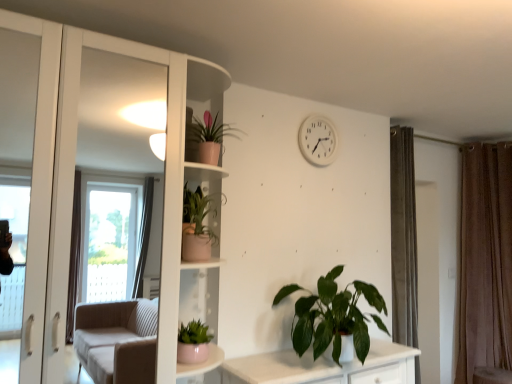
Where is `white plastic clock at upper center`? The height and width of the screenshot is (384, 512). white plastic clock at upper center is located at coordinates (318, 140).

This screenshot has width=512, height=384. What do you see at coordinates (197, 225) in the screenshot?
I see `matte pink pot at center-left, which is the second houseplant in left-to-right order` at bounding box center [197, 225].

Measure the distance between point (208, 238) and camera.

A distance of 2.01 meters exists between point (208, 238) and camera.

Image resolution: width=512 pixels, height=384 pixels. I want to click on matte pink pot at lower center, the 3th houseplant from the top, so click(x=193, y=343).

The width and height of the screenshot is (512, 384). I want to click on brown velvet curtain at right, so click(485, 260).

Which object is further away from the camera, pink matte pot at upper center, the second houseplant viewed from the right, or brown velvet curtain at right?

brown velvet curtain at right.

From the image's perspective, between pink matte pot at upper center, which appears as the third houseplant when viewed from the left, and brown velvet curtain at right, who is located below?

brown velvet curtain at right.

Are pink matte pot at upper center, which appears as the third houseplant when viewed from the left, and brown velvet curtain at right beside each other?

No, pink matte pot at upper center, which appears as the third houseplant when viewed from the left, is not making contact with brown velvet curtain at right.

Could you tell me if pink matte pot at upper center, the second houseplant viewed from the right, is facing brown velvet curtain at right?

No, pink matte pot at upper center, the second houseplant viewed from the right, is not aimed at brown velvet curtain at right.

What's the angular difference between brown velvet curtain at right and matte pink pot at center-left, which is the second houseplant in left-to-right order,'s facing directions?

The angle between the facing direction of brown velvet curtain at right and the facing direction of matte pink pot at center-left, which is the second houseplant in left-to-right order, is 110 degrees.

From the image's perspective, is brown velvet curtain at right on matte pink pot at center-left, the 3th houseplant in the right-to-left sequence?

No, from the image's perspective, brown velvet curtain at right is not over matte pink pot at center-left, the 3th houseplant in the right-to-left sequence.

Is brown velvet curtain at right facing away from matte pink pot at center-left, the third houseplant positioned from the bottom?

That's not correct — brown velvet curtain at right is not looking away from matte pink pot at center-left, the third houseplant positioned from the bottom.

Which point is more distant from viewer, (481, 259) or (188, 216)?

The point (481, 259) is behind.

Is white plastic clock at upper center beside brown velvet curtain at right?

No, white plastic clock at upper center is not making contact with brown velvet curtain at right.

Would you say white plastic clock at upper center contains brown velvet curtain at right?

Definitely not — brown velvet curtain at right is not inside white plastic clock at upper center.

Considering the points (313, 159) and (476, 153), which point is in front, point (313, 159) or point (476, 153)?

The point (313, 159) is closer to the camera.

Which is more to the left, brown velvet curtain at right or green matte plant at lower center, acting as the 4th houseplant starting from the top?

green matte plant at lower center, acting as the 4th houseplant starting from the top.

From the image's perspective, is brown velvet curtain at right located above green matte plant at lower center, which ranks as the 1th houseplant in right-to-left order?

Indeed, from the image's perspective, brown velvet curtain at right is shown above green matte plant at lower center, which ranks as the 1th houseplant in right-to-left order.

Considering the points (505, 293) and (364, 331), which point is in front, point (505, 293) or point (364, 331)?

Positioned in front is point (364, 331).

Could you measure the distance between white plastic clock at upper center and matte pink pot at lower center, the 3th houseplant from the top?

white plastic clock at upper center and matte pink pot at lower center, the 3th houseplant from the top, are 4.68 feet apart.

The height and width of the screenshot is (384, 512). Identify the location of clock above the matte pink pot at lower center, acting as the second houseplant starting from the bottom (from the image's perspective). (318, 140).

Is white plastic clock at upper center in front of matte pink pot at lower center, which is counted as the 1th houseplant, starting from the left?

No, the depth of white plastic clock at upper center is greater than that of matte pink pot at lower center, which is counted as the 1th houseplant, starting from the left.

Looking at this image, considering the relative sizes of white plastic clock at upper center and matte pink pot at lower center, which is counted as the 1th houseplant, starting from the left, in the image provided, is white plastic clock at upper center smaller than matte pink pot at lower center, which is counted as the 1th houseplant, starting from the left,?

Incorrect, white plastic clock at upper center is not smaller in size than matte pink pot at lower center, which is counted as the 1th houseplant, starting from the left.

Considering the positions of objects brown velvet curtain at right and matte pink pot at lower center, which is counted as the 1th houseplant, starting from the left, in the image provided, who is more to the right, brown velvet curtain at right or matte pink pot at lower center, which is counted as the 1th houseplant, starting from the left,?

brown velvet curtain at right.

Is brown velvet curtain at right oriented away from matte pink pot at lower center, placed as the 4th houseplant when sorted from right to left?

No, brown velvet curtain at right's orientation is not away from matte pink pot at lower center, placed as the 4th houseplant when sorted from right to left.

Does point (497, 364) come behind point (190, 334)?

Yes, point (497, 364) is farther from viewer.

From the image's perspective, which is above, pink matte pot at upper center, the second houseplant viewed from the right, or matte pink pot at lower center, the 3th houseplant from the top?

pink matte pot at upper center, the second houseplant viewed from the right, is shown above in the image.

Which of these two, pink matte pot at upper center, which appears as the third houseplant when viewed from the left, or matte pink pot at lower center, acting as the second houseplant starting from the bottom, is wider?

With larger width is matte pink pot at lower center, acting as the second houseplant starting from the bottom.

Is pink matte pot at upper center, the second houseplant viewed from the right, next to matte pink pot at lower center, placed as the 4th houseplant when sorted from right to left, and touching it?

pink matte pot at upper center, the second houseplant viewed from the right, is not next to matte pink pot at lower center, placed as the 4th houseplant when sorted from right to left, and they're not touching.

At what (x,y) coordinates should I click in order to perform the action: click on houseplant that is the 2nd object to the left of the pink matte pot at upper center, which appears as the third houseplant when viewed from the left, starting at the anchor. Please return your answer as a coordinate pair (x, y). The height and width of the screenshot is (384, 512). Looking at the image, I should click on (193, 343).

Where is `curtain behind the pink matte pot at upper center, the second houseplant viewed from the right`? This screenshot has height=384, width=512. curtain behind the pink matte pot at upper center, the second houseplant viewed from the right is located at coordinates (485, 260).

Starting from the brown velvet curtain at right, which houseplant is the 2nd one in front? Please provide its 2D coordinates.

[(197, 225)]

Estimate the real-world distances between objects in this image. Which object is further from green matte plant at lower center, acting as the 4th houseplant starting from the top, brown velvet curtain at right or matte pink pot at center-left, the second houseplant viewed from the top?

brown velvet curtain at right.

Looking at the image, which one is located closer to white plastic clock at upper center, pink matte pot at upper center, the second houseplant viewed from the right, or brown velvet curtain at right?

Based on the image, pink matte pot at upper center, the second houseplant viewed from the right, appears to be nearer to white plastic clock at upper center.

Estimate the real-world distances between objects in this image. Which object is closer to white plastic clock at upper center, matte pink pot at center-left, the third houseplant positioned from the bottom, or pink matte pot at upper center, which appears as the third houseplant when viewed from the left?

Among the two, pink matte pot at upper center, which appears as the third houseplant when viewed from the left, is located nearer to white plastic clock at upper center.

Based on their spatial positions, is green matte plant at lower center, the 1th houseplant from the bottom, or pink matte pot at upper center, the first houseplant viewed from the top, closer to brown velvet curtain at right?

green matte plant at lower center, the 1th houseplant from the bottom, lies closer to brown velvet curtain at right than the other object.

Estimate the real-world distances between objects in this image. Which object is closer to pink matte pot at upper center, which appears as the third houseplant when viewed from the left, brown velvet curtain at right or matte pink pot at lower center, which is counted as the 1th houseplant, starting from the left?

matte pink pot at lower center, which is counted as the 1th houseplant, starting from the left.

Looking at this image, looking at the image, which one is located further to green matte plant at lower center, which ranks as the 1th houseplant in right-to-left order, matte pink pot at center-left, the 3th houseplant in the right-to-left sequence, or pink matte pot at upper center, which appears as the third houseplant when viewed from the left?

pink matte pot at upper center, which appears as the third houseplant when viewed from the left, is positioned further to the anchor green matte plant at lower center, which ranks as the 1th houseplant in right-to-left order.

From the image, which object appears to be farther from matte pink pot at center-left, the third houseplant positioned from the bottom, green matte plant at lower center, acting as the 4th houseplant starting from the top, or pink matte pot at upper center, the second houseplant viewed from the right?

green matte plant at lower center, acting as the 4th houseplant starting from the top.

When comparing their distances from pink matte pot at upper center, the first houseplant viewed from the top, does matte pink pot at center-left, the third houseplant positioned from the bottom, or matte pink pot at lower center, acting as the second houseplant starting from the bottom, seem further?

The object further to pink matte pot at upper center, the first houseplant viewed from the top, is matte pink pot at lower center, acting as the second houseplant starting from the bottom.

Identify the location of houseplant between pink matte pot at upper center, the first houseplant viewed from the top, and brown velvet curtain at right. Image resolution: width=512 pixels, height=384 pixels. (332, 316).

The image size is (512, 384). I want to click on houseplant located between white plastic clock at upper center and brown velvet curtain at right in the left-right direction, so click(332, 316).

The height and width of the screenshot is (384, 512). In order to click on houseplant that lies between pink matte pot at upper center, which appears as the third houseplant when viewed from the left, and matte pink pot at lower center, which is counted as the 1th houseplant, starting from the left, from top to bottom in this screenshot , I will do `click(197, 225)`.

I want to click on clock between matte pink pot at lower center, the 3th houseplant from the top, and brown velvet curtain at right from left to right, so click(x=318, y=140).